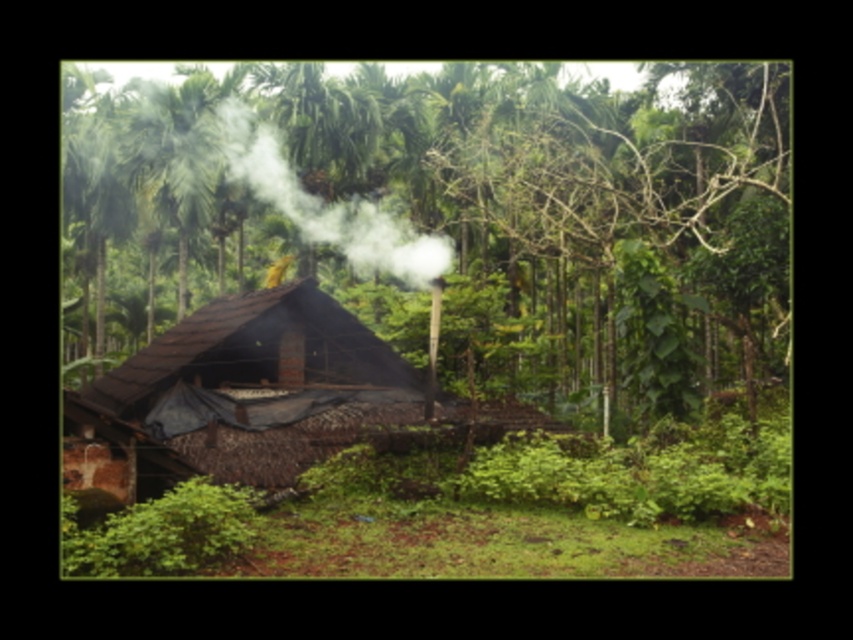
Question: Considering the real-world distances, which object is farthest from the white smoke at center?

Choices:
 (A) brown thatched hut at center
 (B) brown thatched roof at center

Answer: (A)

Question: Which point is farther to the camera?

Choices:
 (A) (192, 444)
 (B) (277, 193)
 (C) (450, 253)

Answer: (C)

Question: Which of the following is the farthest from the observer?

Choices:
 (A) brown thatched roof at center
 (B) brown thatched hut at center
 (C) white smoke at center

Answer: (C)

Question: Observing the image, what is the correct spatial positioning of brown thatched roof at center in reference to white smoke at center?

Choices:
 (A) left
 (B) right

Answer: (B)

Question: Does brown thatched roof at center appear over white smoke at center?

Choices:
 (A) yes
 (B) no

Answer: (A)

Question: Can you confirm if brown thatched roof at center is positioned to the right of brown thatched hut at center?

Choices:
 (A) no
 (B) yes

Answer: (B)